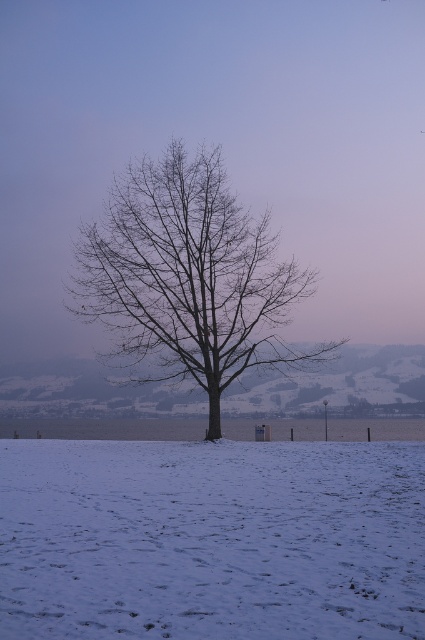
You are standing at the point with coordinates 0.5, 0.5 in the image. You want to walk to the white powdery snow at center. Is it possible to walk directly to it without moving left or right?

The white powdery snow at center is located at point [210,540]. Since you are at [212,320], you would need to move right to reach it, so you can walk directly to it by moving right without needing to adjust your left or right direction.

You are a hiker who wants to take a photo of the bare wood tree at center from a distance. Since the white powdery snow at center is in the way, can you step aside to get a clear shot?

The white powdery snow at center is positioned under the bare wood tree at center, so stepping aside might not remove the snow from the shot since it is directly beneath the tree. You may need to adjust your angle or move further back to avoid the snow obstructing the view.